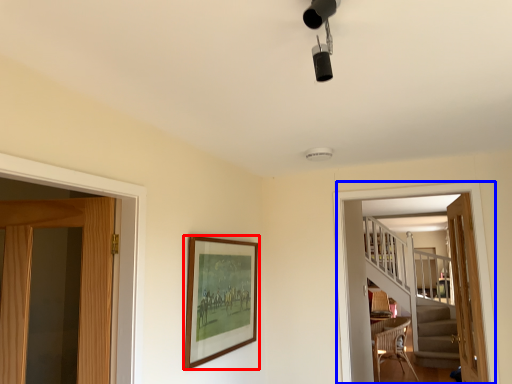
Question: Which point is closer to the camera, picture frame (highlighted by a red box) or screen door (highlighted by a blue box)?

Choices:
 (A) picture frame
 (B) screen door

Answer: (A)